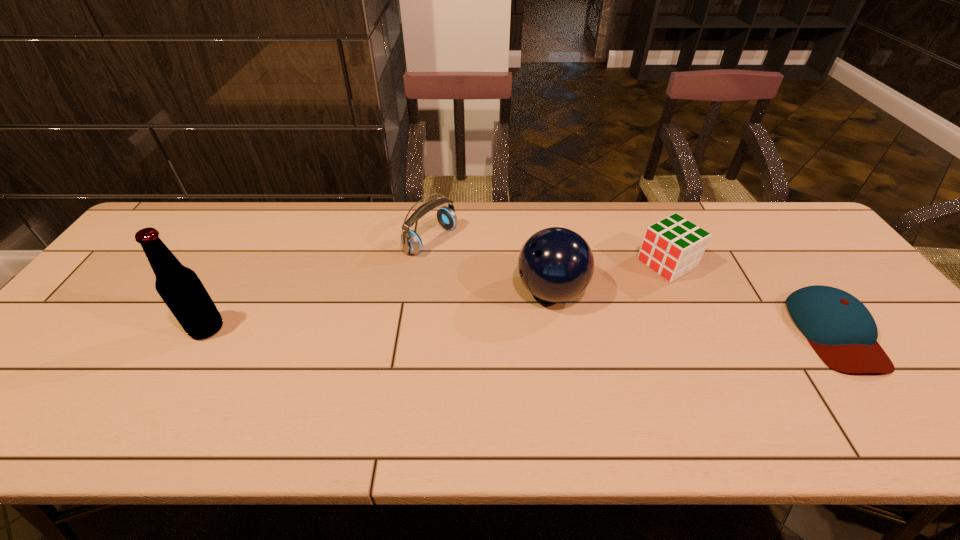
Identify the location of vacant region located on the right of the tallest object. (369, 328).

What are the coordinates of `free region located on the red face of the second object from right to left` in the screenshot? It's located at (601, 301).

I want to click on free location located 0.170m on the red face of the second object from right to left, so click(x=604, y=299).

What are the coordinates of `vacant space located 0.230m on the red face of the second object from right to left` in the screenshot? It's located at (588, 308).

Find the location of a particular element. Image resolution: width=960 pixels, height=540 pixels. free space located 0.160m on the ear cups of the third shortest object is located at coordinates (492, 276).

The image size is (960, 540). What are the coordinates of `blank area located on the ear cups of the third shortest object` in the screenshot? It's located at pos(516,289).

Where is `free space located 0.130m on the ear cups of the third shortest object`? free space located 0.130m on the ear cups of the third shortest object is located at coordinates (484, 271).

At what (x,y) coordinates should I click in order to perform the action: click on vacant space located 0.320m on the surface of the second tallest object near the finger holes. Please return your answer as a coordinate pair (x, y). Looking at the image, I should click on (420, 369).

Where is `vacant area situated 0.260m on the surface of the second tallest object near the finger holes`? The height and width of the screenshot is (540, 960). vacant area situated 0.260m on the surface of the second tallest object near the finger holes is located at coordinates (441, 356).

Find the location of a particular element. This screenshot has width=960, height=540. free space located on the surface of the second tallest object near the finger holes is located at coordinates (408, 376).